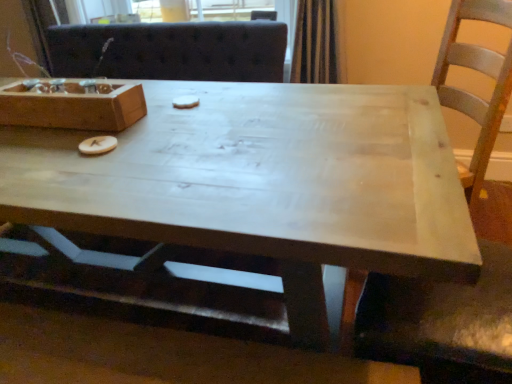
Question: Can you confirm if wooden box at upper left is thinner than white matte cookie at center, which appears as the 2th food when viewed from the front?

Choices:
 (A) no
 (B) yes

Answer: (A)

Question: Is wooden box at upper left oriented away from white matte cookie at center, which is the 2th food from bottom to top?

Choices:
 (A) no
 (B) yes

Answer: (A)

Question: From the image's perspective, is wooden box at upper left on white matte cookie at center, positioned as the first food in top-to-bottom order?

Choices:
 (A) yes
 (B) no

Answer: (B)

Question: Is wooden box at upper left surrounding white matte cookie at center, which is the 2th food in left-to-right order?

Choices:
 (A) no
 (B) yes

Answer: (A)

Question: Are wooden box at upper left and white matte cookie at center, which is the 2th food in left-to-right order, making contact?

Choices:
 (A) no
 (B) yes

Answer: (A)

Question: Is wooden box at upper left to the left of white matte cookie at center, which is the 2th food in left-to-right order, from the viewer's perspective?

Choices:
 (A) no
 (B) yes

Answer: (B)

Question: Is the surface of white matte cookie at center, the first food when ordered from right to left, in direct contact with light wood coffee table at center?

Choices:
 (A) yes
 (B) no

Answer: (B)

Question: Does white matte cookie at center, which appears as the 2th food when viewed from the front, have a lesser height compared to light wood coffee table at center?

Choices:
 (A) no
 (B) yes

Answer: (B)

Question: Does white matte cookie at center, which is the 2th food from bottom to top, come behind light wood coffee table at center?

Choices:
 (A) yes
 (B) no

Answer: (A)

Question: Is white matte cookie at center, the first food when ordered from right to left, facing away from light wood coffee table at center?

Choices:
 (A) no
 (B) yes

Answer: (B)

Question: Is white matte cookie at center, the first food when ordered from right to left, not close to light wood coffee table at center?

Choices:
 (A) no
 (B) yes

Answer: (A)

Question: Is light wood coffee table at center surrounded by white matte cookie at center, which appears as the 2th food when viewed from the front?

Choices:
 (A) yes
 (B) no

Answer: (B)

Question: Is white matte cookie at center, which is the first food from back to front, with wooden letter at center, which appears as the first food when viewed from the left?

Choices:
 (A) no
 (B) yes

Answer: (A)